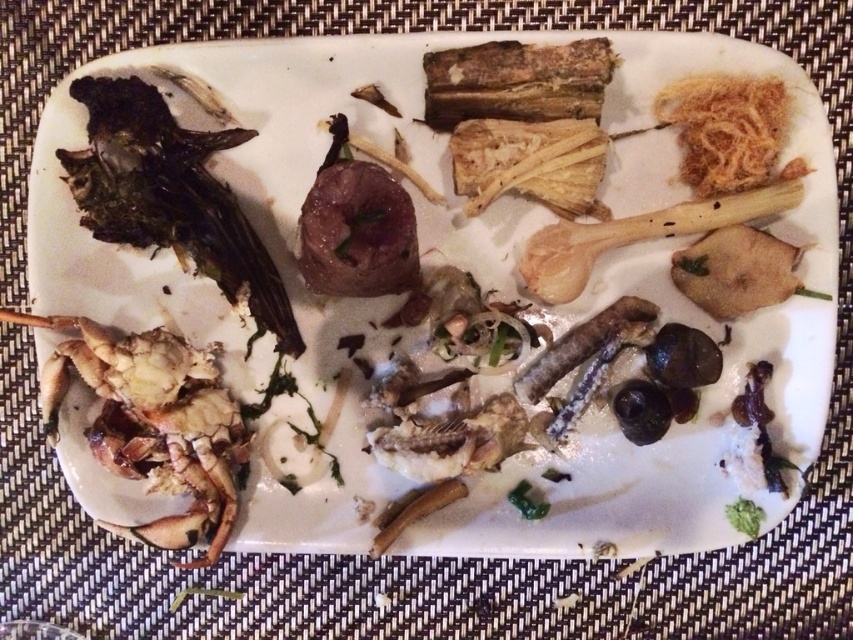
You are a waiter clearing the table. You see two points on the plate. Which point is closer to you, point (219, 202) or point (712, 116)?

Point (712, 116) is closer to you because point (219, 202) is behind it.

Looking at this image, you are standing 1.22 meters away from the camera. Can you see the point at coordinates point (109, 241)?

Yes, the point at point (109, 241) is exactly 1.22 meters away from the camera, so you are standing at the same distance as the camera to that point, meaning you can see it.

You are a food critic inspecting a plate. You notice the charcoal black seaweed at left and the golden crispy noodles at upper right. Based on their positions, which item is closer to the edge of the plate on the left side?

The charcoal black seaweed at left is closer to the edge of the plate on the left side because it is positioned to the left of the golden crispy noodles at upper right.